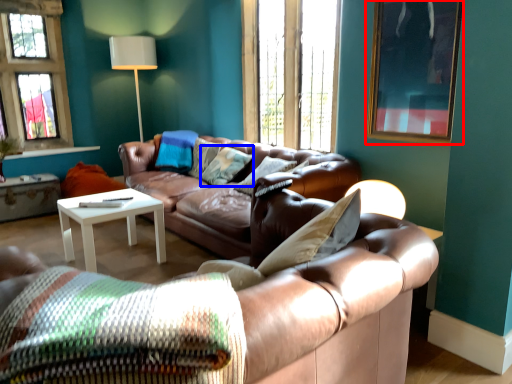
Question: Which of the following is the farthest to the observer, picture frame (highlighted by a red box) or pillow (highlighted by a blue box)?

Choices:
 (A) picture frame
 (B) pillow

Answer: (B)